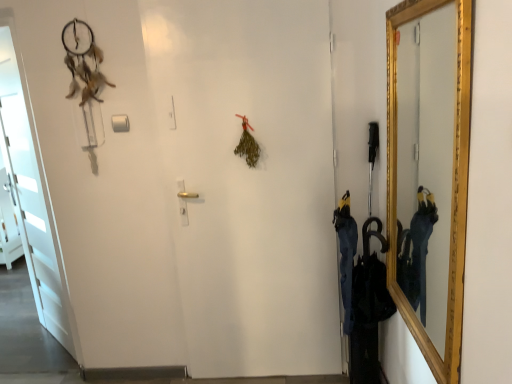
The width and height of the screenshot is (512, 384). Describe the element at coordinates (30, 195) in the screenshot. I see `white matte door at left` at that location.

In order to face white matte door at left, should I rotate leftwards or rightwards?

You should rotate left by 27.942 degrees.

I want to click on white matte door at left, so click(x=30, y=195).

Describe the element at coordinates (426, 164) in the screenshot. The width and height of the screenshot is (512, 384). I see `gold-framed mirror at right` at that location.

Find the location of a particular element. This screenshot has height=384, width=512. gold-framed mirror at right is located at coordinates (426, 164).

At what (x,y) coordinates should I click in order to perform the action: click on white matte door at left. Please return your answer as a coordinate pair (x, y). Image resolution: width=512 pixels, height=384 pixels. Looking at the image, I should click on (30, 195).

Considering the positions of objects white matte door at left and gold-framed mirror at right in the image provided, who is more to the right, white matte door at left or gold-framed mirror at right?

From the viewer's perspective, gold-framed mirror at right appears more on the right side.

In the image, is white matte door at left positioned in front of or behind gold-framed mirror at right?

In the image, white matte door at left appears behind gold-framed mirror at right.

Is point (51, 242) positioned in front of point (448, 40)?

That is False.

From the image's perspective, is white matte door at left positioned above or below gold-framed mirror at right?

Based on their image positions, white matte door at left is located beneath gold-framed mirror at right.

From a real-world perspective, is white matte door at left positioned above or below gold-framed mirror at right?

From a real-world perspective, white matte door at left is physically below gold-framed mirror at right.

Considering the relative sizes of white matte door at left and gold-framed mirror at right in the image provided, is white matte door at left thinner than gold-framed mirror at right?

In fact, white matte door at left might be wider than gold-framed mirror at right.

Considering the relative sizes of white matte door at left and gold-framed mirror at right in the image provided, is white matte door at left taller than gold-framed mirror at right?

Yes, white matte door at left is taller than gold-framed mirror at right.

Based on the photo, can you confirm if white matte door at left is bigger than gold-framed mirror at right?

Indeed, white matte door at left has a larger size compared to gold-framed mirror at right.

Consider the image. Is white matte door at left situated inside gold-framed mirror at right or outside?

white matte door at left is outside gold-framed mirror at right.

Consider the image. Is white matte door at left far away from gold-framed mirror at right?

Yes, white matte door at left is far from gold-framed mirror at right.

Is white matte door at left oriented towards gold-framed mirror at right?

No.

Measure the distance between white matte door at left and gold-framed mirror at right.

The distance of white matte door at left from gold-framed mirror at right is 6.74 feet.

In order to click on door on the left of gold-framed mirror at right in this screenshot , I will do `click(30, 195)`.

Between gold-framed mirror at right and white matte door at left, which one appears on the right side from the viewer's perspective?

gold-framed mirror at right.

In the scene shown: Is gold-framed mirror at right in front of or behind white matte door at left in the image?

gold-framed mirror at right is in front of white matte door at left.

Is point (441, 137) farther from viewer compared to point (21, 239)?

That is False.

From the image's perspective, is gold-framed mirror at right located beneath white matte door at left?

No, from the image's perspective, gold-framed mirror at right is not below white matte door at left.

From a real-world perspective, relative to white matte door at left, is gold-framed mirror at right vertically above or below?

In terms of real-world spatial position, gold-framed mirror at right is above white matte door at left.

Which object is thinner, gold-framed mirror at right or white matte door at left?

gold-framed mirror at right.

Between gold-framed mirror at right and white matte door at left, which one has more height?

white matte door at left.

Considering the relative sizes of gold-framed mirror at right and white matte door at left in the image provided, is gold-framed mirror at right smaller than white matte door at left?

Yes.

Is gold-framed mirror at right situated inside white matte door at left or outside?

gold-framed mirror at right is not inside white matte door at left, it's outside.

Is gold-framed mirror at right far from white matte door at left?

Yes.

Could you tell me if gold-framed mirror at right is turned towards white matte door at left?

Yes, gold-framed mirror at right is facing white matte door at left.

Locate an element on the screen. mirror located above the white matte door at left (from the image's perspective) is located at coordinates (426, 164).

This screenshot has height=384, width=512. In the image, there is a gold-framed mirror at right. What are the coordinates of `door below it (from the image's perspective)` in the screenshot? It's located at (30, 195).

At what (x,y) coordinates should I click in order to perform the action: click on mirror on the right side of white matte door at left. Please return your answer as a coordinate pair (x, y). Looking at the image, I should click on (426, 164).